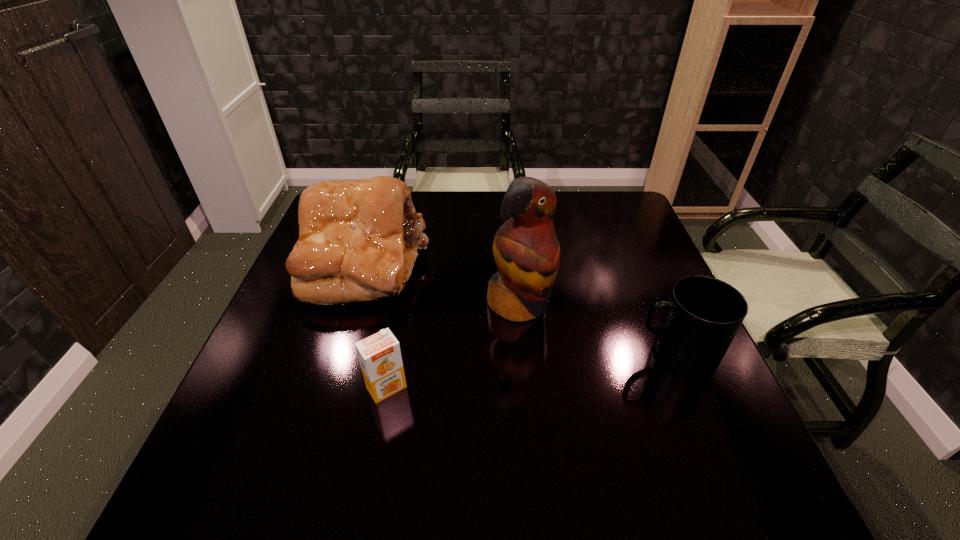
Image resolution: width=960 pixels, height=540 pixels. Identify the location of free space that is in between the third shortest object and the orange juice. (374, 326).

This screenshot has width=960, height=540. I want to click on vacant area that lies between the rightmost object and the third object from left to right, so click(597, 329).

Where is `empty space between the orange juice and the bread`? This screenshot has width=960, height=540. empty space between the orange juice and the bread is located at coordinates (374, 326).

Find the location of a particular element. free space between the second object from right to left and the orange juice is located at coordinates (453, 346).

Locate an element on the screen. the third closest object to the parrot is located at coordinates (379, 355).

Where is `object that is the third closest one to the third shortest object`? This screenshot has width=960, height=540. object that is the third closest one to the third shortest object is located at coordinates (703, 314).

The image size is (960, 540). What are the coordinates of `free location that satisfies the following two spatial constraints: 1. on the back side of the rightmost object; 2. on the side of the orange juice with the handle` in the screenshot? It's located at (394, 353).

You are a GUI agent. You are given a task and a screenshot of the screen. Output one action in this format:
    pyautogui.click(x=<x>, y=<y>)
    Task: Click on the vacant space that satisfies the following two spatial constraints: 1. on the back side of the orange juice; 2. on the right side of the parrot
    The width and height of the screenshot is (960, 540).
    Given the screenshot: What is the action you would take?
    pyautogui.click(x=402, y=305)

Where is `free point that satisfies the following two spatial constraints: 1. on the back side of the orange juice; 2. on the side of the rightmost object with the handle`? free point that satisfies the following two spatial constraints: 1. on the back side of the orange juice; 2. on the side of the rightmost object with the handle is located at coordinates (394, 353).